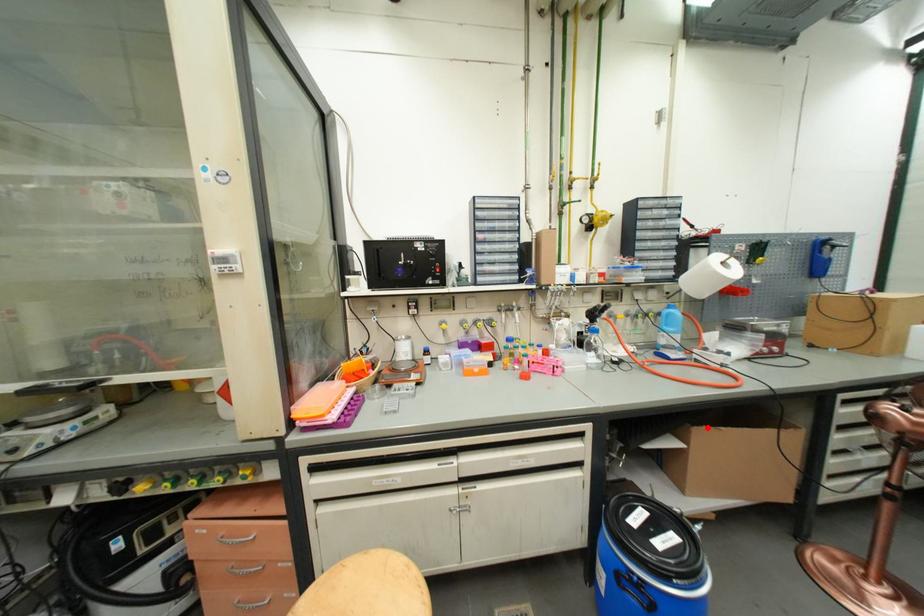
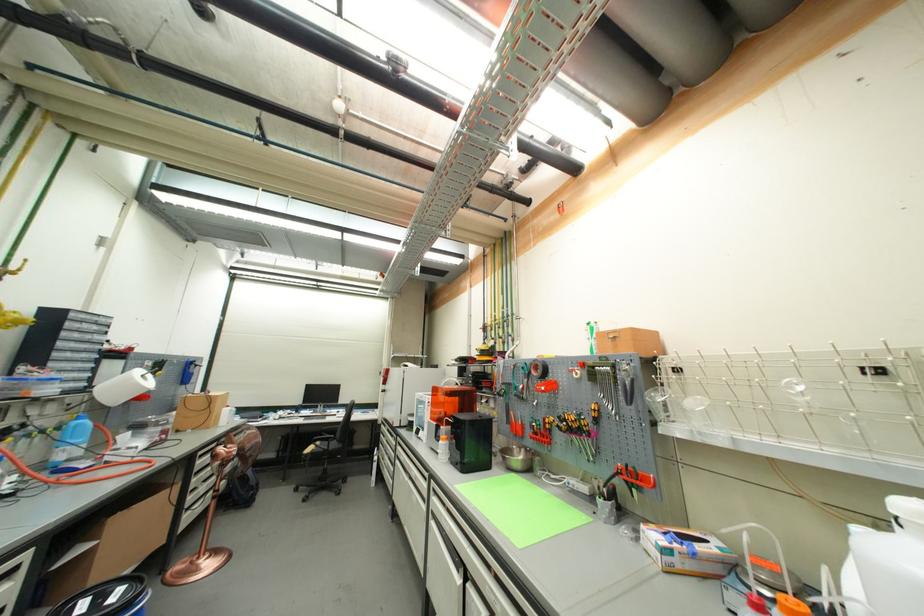
Question: I am providing you with two images of the same scene from different viewpoints. A red point is marked on the first image. Is the red point's position out of view in image 2?

Choices:
 (A) Yes
 (B) No

Answer: (B)